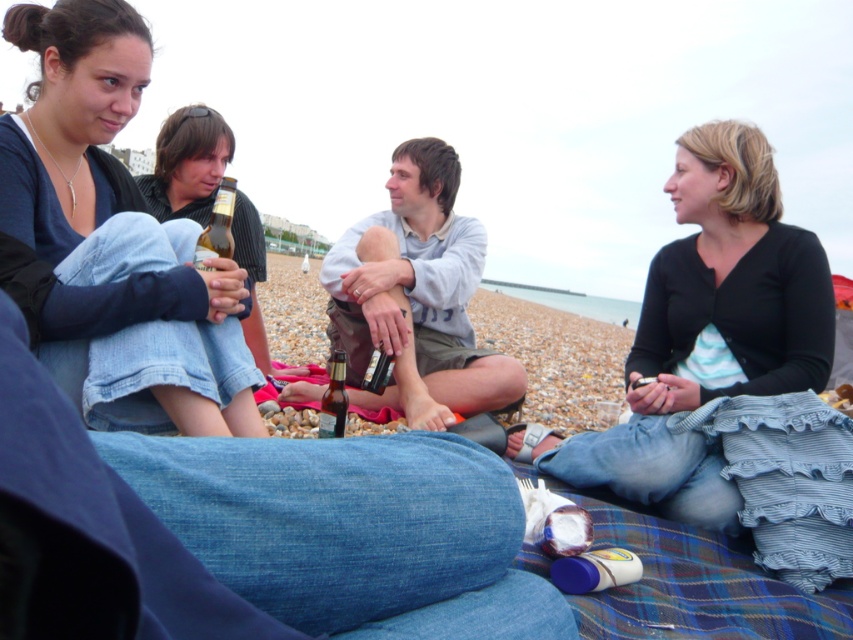
Question: Considering the real-world distances, which object is closest to the black cotton shirt at upper right?

Choices:
 (A) denim jeans at left
 (B) translucent plastic bottle at center
 (C) matte black shirt at left

Answer: (B)

Question: Which of the following is the farthest from the observer?

Choices:
 (A) brown glass bottle at center
 (B) denim jeans at left
 (C) black cotton shirt at upper right

Answer: (A)

Question: Does denim jeans at left appear over matte black shirt at left?

Choices:
 (A) no
 (B) yes

Answer: (A)

Question: Is matte black shirt at left closer to camera compared to translucent plastic bottle at center?

Choices:
 (A) no
 (B) yes

Answer: (B)

Question: Does black cotton shirt at upper right have a larger size compared to brown glass bottle at center?

Choices:
 (A) yes
 (B) no

Answer: (A)

Question: Which of the following is the farthest from the observer?

Choices:
 (A) brown glass bottle at center
 (B) black cotton shirt at upper right

Answer: (A)